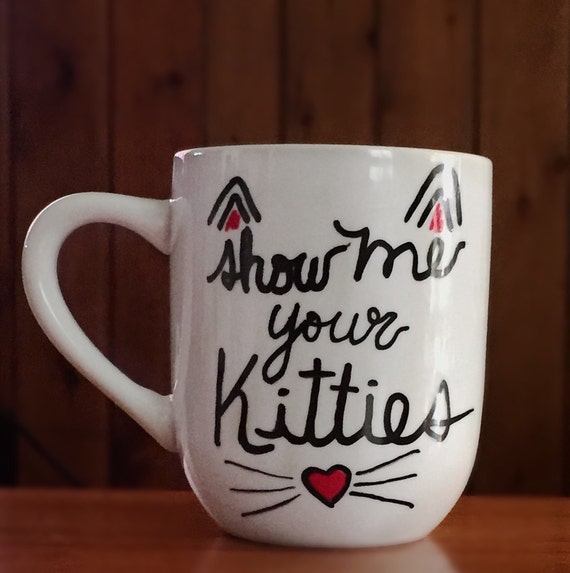
At what (x,y) coordinates should I click in order to perform the action: click on brown table. Please return your answer as a coordinate pair (x, y). Looking at the image, I should click on (259, 555).